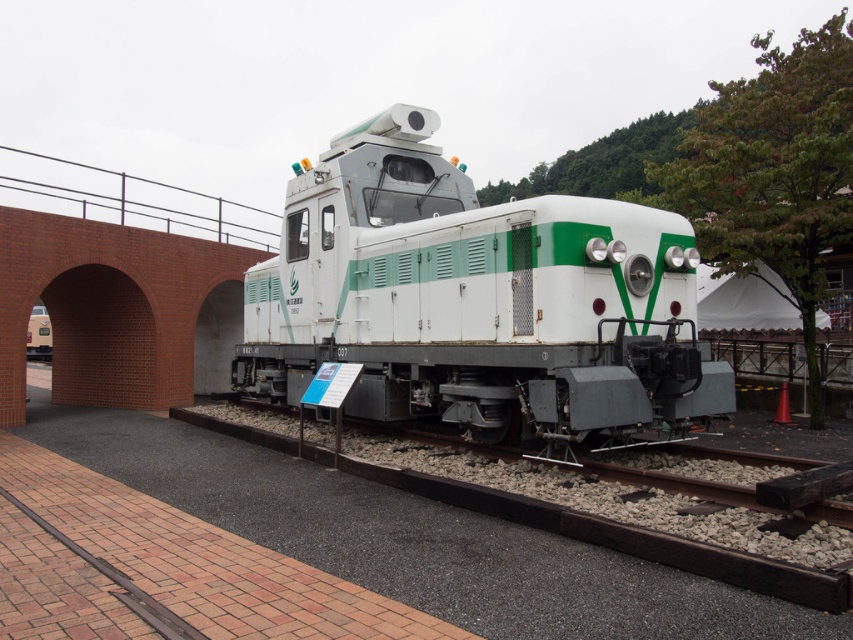
Question: Which point is closer to the camera taking this photo?

Choices:
 (A) coord(457,212)
 (B) coord(131,300)

Answer: (A)

Question: Can you confirm if white/green painted locomotive at center is thinner than brick at left?

Choices:
 (A) yes
 (B) no

Answer: (A)

Question: Which of the following is the closest to the observer?

Choices:
 (A) (569, 435)
 (B) (225, 253)

Answer: (A)

Question: Does white/green painted locomotive at center appear on the right side of brick at left?

Choices:
 (A) no
 (B) yes

Answer: (B)

Question: Is white/green painted locomotive at center in front of brick at left?

Choices:
 (A) no
 (B) yes

Answer: (B)